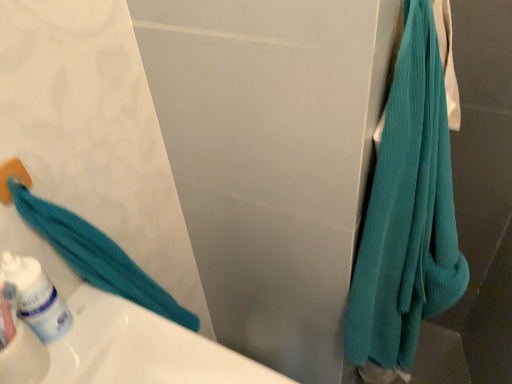
Describe the element at coordinates (407, 212) in the screenshot. This screenshot has width=512, height=384. I see `teal ribbed towel at right` at that location.

Find the location of a particular element. This screenshot has height=384, width=512. teal ribbed towel at right is located at coordinates (407, 212).

What is the approximate width of white glossy mouthwash at lower left?

white glossy mouthwash at lower left is 2.43 inches in width.

What do you see at coordinates (36, 297) in the screenshot?
I see `white glossy mouthwash at lower left` at bounding box center [36, 297].

Locate an element on the screen. white glossy mouthwash at lower left is located at coordinates (36, 297).

In order to face white glossy mouthwash at lower left, should I rotate leftwards or rightwards?

To face it directly, rotate left by 26.973 degrees.

At what (x,y) coordinates should I click in order to perform the action: click on teal ribbed towel at right. Please return your answer as a coordinate pair (x, y). The image size is (512, 384). Looking at the image, I should click on (407, 212).

Based on the photo, based on their positions, is white glossy mouthwash at lower left located to the left or right of teal ribbed towel at right?

In the image, white glossy mouthwash at lower left appears on the left side of teal ribbed towel at right.

Does white glossy mouthwash at lower left come in front of teal ribbed towel at right?

That is False.

Between point (40, 321) and point (379, 343), which one is positioned in front?

The point (40, 321) is closer to the camera.

From the image's perspective, which is below, white glossy mouthwash at lower left or teal ribbed towel at right?

From the image's view, white glossy mouthwash at lower left is below.

From a real-world perspective, who is located higher, white glossy mouthwash at lower left or teal ribbed towel at right?

white glossy mouthwash at lower left is physically above.

Considering the relative sizes of white glossy mouthwash at lower left and teal ribbed towel at right in the image provided, is white glossy mouthwash at lower left wider than teal ribbed towel at right?

No, white glossy mouthwash at lower left is not wider than teal ribbed towel at right.

Considering the relative sizes of white glossy mouthwash at lower left and teal ribbed towel at right in the image provided, is white glossy mouthwash at lower left taller than teal ribbed towel at right?

No.

Is white glossy mouthwash at lower left bigger than teal ribbed towel at right?

No.

Is white glossy mouthwash at lower left positioned beyond the bounds of teal ribbed towel at right?

Yes, white glossy mouthwash at lower left is outside of teal ribbed towel at right.

Is white glossy mouthwash at lower left positioned far away from teal ribbed towel at right?

That's not correct — white glossy mouthwash at lower left is a little close to teal ribbed towel at right.

Is white glossy mouthwash at lower left looking in the opposite direction of teal ribbed towel at right?

No.

Measure the distance from white glossy mouthwash at lower left to teal ribbed towel at right.

24.69 inches.

Where is `mouthwash below the teal ribbed towel at right (from the image's perspective)`? This screenshot has height=384, width=512. mouthwash below the teal ribbed towel at right (from the image's perspective) is located at coordinates (36, 297).

Based on their positions, is teal ribbed towel at right located to the left or right of white glossy mouthwash at lower left?

Clearly, teal ribbed towel at right is on the right of white glossy mouthwash at lower left in the image.

Is teal ribbed towel at right closer to the viewer compared to white glossy mouthwash at lower left?

That is True.

Is point (457, 252) closer to camera compared to point (11, 270)?

No, it is behind (11, 270).

From the image's perspective, which object appears higher, teal ribbed towel at right or white glossy mouthwash at lower left?

teal ribbed towel at right is shown above in the image.

From a real-world perspective, is teal ribbed towel at right under white glossy mouthwash at lower left?

Indeed, from a real-world perspective, teal ribbed towel at right is positioned beneath white glossy mouthwash at lower left.

Looking at this image, can you confirm if teal ribbed towel at right is wider than white glossy mouthwash at lower left?

Yes.

Considering the relative sizes of teal ribbed towel at right and white glossy mouthwash at lower left in the image provided, is teal ribbed towel at right taller than white glossy mouthwash at lower left?

Yes, teal ribbed towel at right is taller than white glossy mouthwash at lower left.

Considering the relative sizes of teal ribbed towel at right and white glossy mouthwash at lower left in the image provided, is teal ribbed towel at right smaller than white glossy mouthwash at lower left?

Actually, teal ribbed towel at right might be larger than white glossy mouthwash at lower left.

Is white glossy mouthwash at lower left inside teal ribbed towel at right?

No.

Is teal ribbed towel at right far from white glossy mouthwash at lower left?

No, teal ribbed towel at right is in close proximity to white glossy mouthwash at lower left.

Is teal ribbed towel at right oriented towards white glossy mouthwash at lower left?

No, teal ribbed towel at right is not facing towards white glossy mouthwash at lower left.

The image size is (512, 384). What are the coordinates of `mouthwash below the teal ribbed towel at right (from the image's perspective)` in the screenshot? It's located at (36, 297).

I want to click on mouthwash to the left of teal ribbed towel at right, so click(36, 297).

You are a GUI agent. You are given a task and a screenshot of the screen. Output one action in this format:
    pyautogui.click(x=<x>, y=<y>)
    Task: Click on the towel above the white glossy mouthwash at lower left (from the image's perspective)
    The width and height of the screenshot is (512, 384).
    Given the screenshot: What is the action you would take?
    coord(407,212)